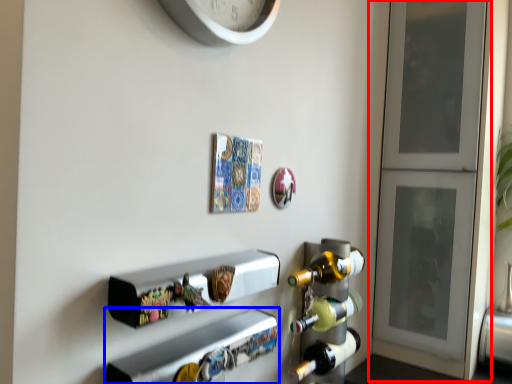
Question: Which point is closer to the camera, door (highlighted by a red box) or shelf (highlighted by a blue box)?

Choices:
 (A) door
 (B) shelf

Answer: (B)